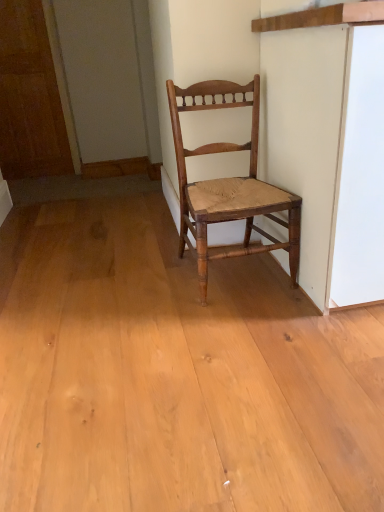
This screenshot has width=384, height=512. I want to click on vacant location below natural wood chair at center (from a real-world perspective), so click(x=243, y=274).